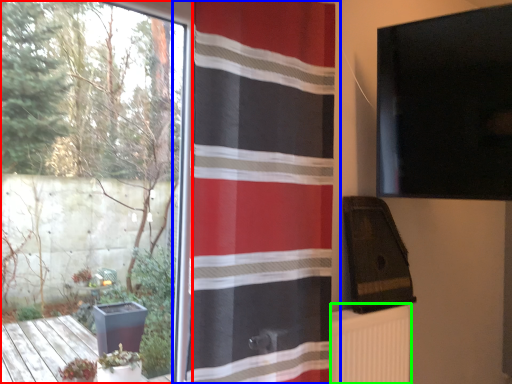
Question: Which object is positioned farthest from window (highlighted by a red box)? Select from curtain (highlighted by a blue box) and radiator (highlighted by a green box).

Choices:
 (A) curtain
 (B) radiator

Answer: (B)